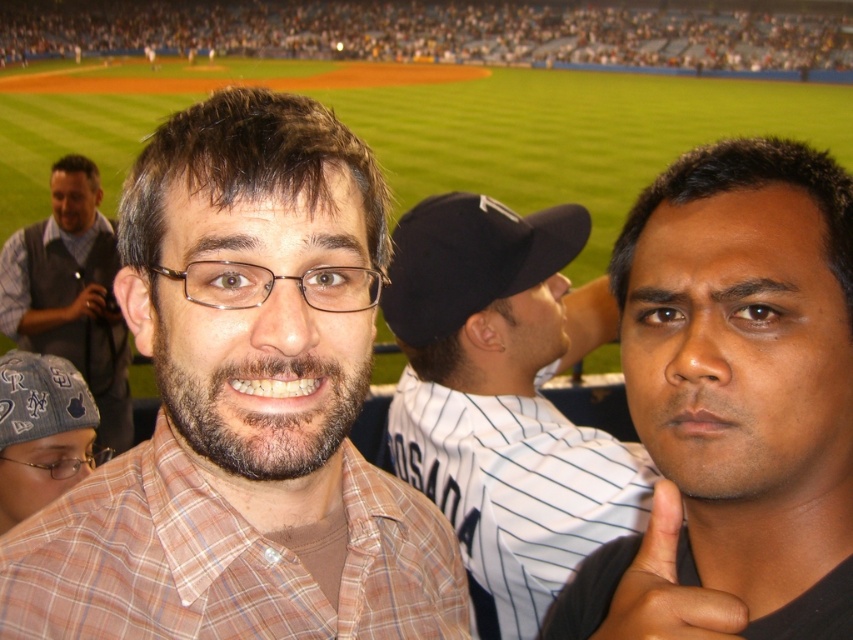
Question: Which object is farther from the camera taking this photo?

Choices:
 (A) black matte camera at upper left
 (B) dark skin smooth face at center

Answer: (A)

Question: Which of the following is the closest to the observer?

Choices:
 (A) (199, 586)
 (B) (401, 291)
 (C) (26, 461)

Answer: (A)

Question: Is plaid shirt at center smaller than dark skin smooth face at center?

Choices:
 (A) no
 (B) yes

Answer: (A)

Question: Which object appears closest to the camera in this image?

Choices:
 (A) dark skin textured hand at right
 (B) gray vest at left

Answer: (A)

Question: Does white pinstriped jersey at center appear over gray vest at left?

Choices:
 (A) yes
 (B) no

Answer: (B)

Question: Does plaid shirt at center have a lesser width compared to black matte camera at upper left?

Choices:
 (A) yes
 (B) no

Answer: (B)